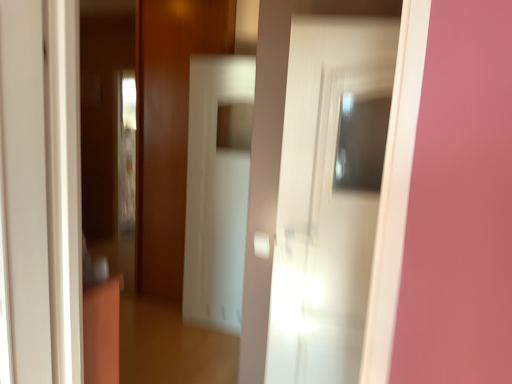
Question: Considering the positions of white glossy door at left, the second door viewed from the right, and white glossy screen door at center in the image, is white glossy door at left, the second door viewed from the right, taller or shorter than white glossy screen door at center?

Choices:
 (A) short
 (B) tall

Answer: (A)

Question: Considering the positions of white glossy door at left, which is the 1th door from left to right, and white glossy screen door at center in the image, is white glossy door at left, which is the 1th door from left to right, wider or thinner than white glossy screen door at center?

Choices:
 (A) wide
 (B) thin

Answer: (A)

Question: Which object is the closest to the white glossy door at center, the 1th door from the back?

Choices:
 (A) white glossy screen door at center
 (B) white glossy door at left, the 1th door viewed from the front

Answer: (B)

Question: Which object is the closest to the white glossy door at center, the 1th door from the back?

Choices:
 (A) white glossy door at left, the 1th door viewed from the front
 (B) white glossy screen door at center

Answer: (A)